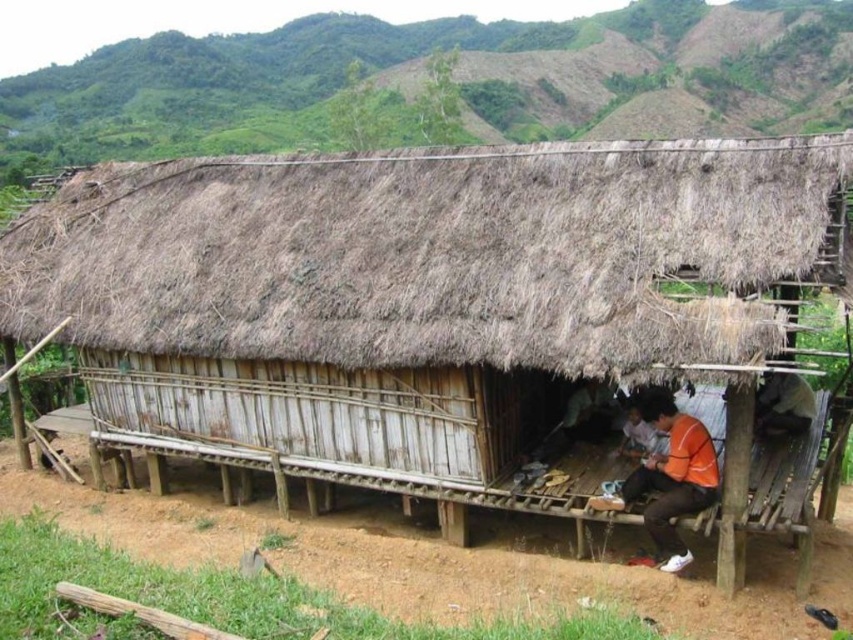
You are standing on the wooden platform in front of the rustic wooden structure. You notice the brown thatch at center and the green grassy hillside at upper center. Which of these two objects is taller from your viewpoint?

The green grassy hillside at upper center is taller than the brown thatch at center.

Based on the photo, you are standing in front of the rustic wooden structure and notice the green grassy hillside at upper center and the orange fabric shirt at lower center. Which of these two objects occupies a larger area in the scene?

The green grassy hillside at upper center occupies a larger area than the orange fabric shirt at lower center because its width is greater according to the description.

You are standing at the origin point of the coordinate system. Where is the brown thatch at center located?

The brown thatch at center is located at point [431,253].